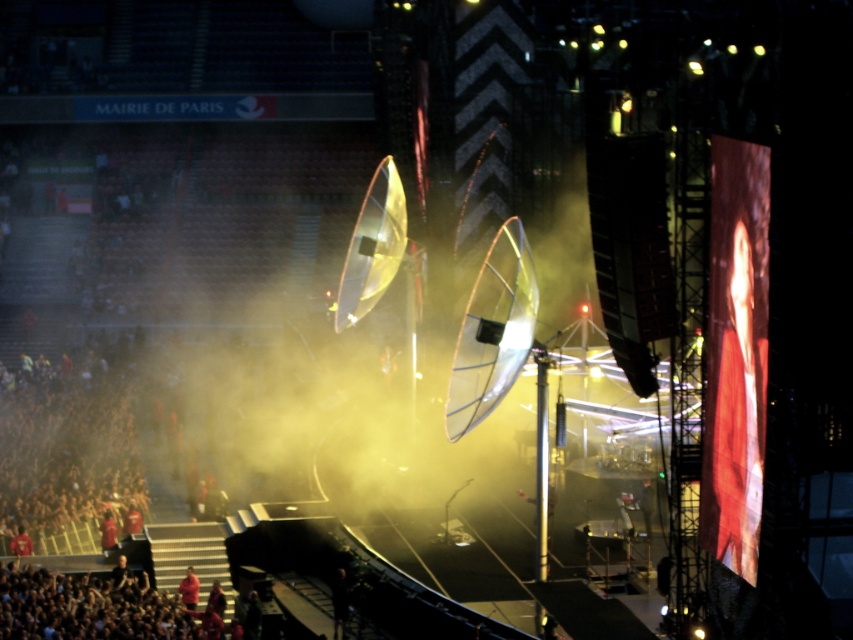
Measure the distance from red fabric crowd at lower left to matte red shirt at center.

red fabric crowd at lower left and matte red shirt at center are 4.18 meters apart.

Who is more distant from viewer, (50, 593) or (189, 589)?

The point (189, 589) is more distant.

Identify the location of red fabric crowd at lower left. The width and height of the screenshot is (853, 640). (86, 608).

Image resolution: width=853 pixels, height=640 pixels. In order to click on matte red shirt at center in this screenshot , I will do `click(189, 588)`.

Who is more distant from viewer, (189, 570) or (114, 531)?

Positioned behind is point (114, 531).

This screenshot has height=640, width=853. What are the coordinates of `matte red shirt at center` in the screenshot? It's located at (189, 588).

What do you see at coordinates (86, 608) in the screenshot?
I see `red fabric crowd at lower left` at bounding box center [86, 608].

How much distance is there between red fabric crowd at lower left and red fabric person at lower left?

They are 10.72 meters apart.

Is point (132, 579) positioned in front of point (102, 541)?

Yes, it is.

Where is `red fabric crowd at lower left`? This screenshot has height=640, width=853. red fabric crowd at lower left is located at coordinates (86, 608).